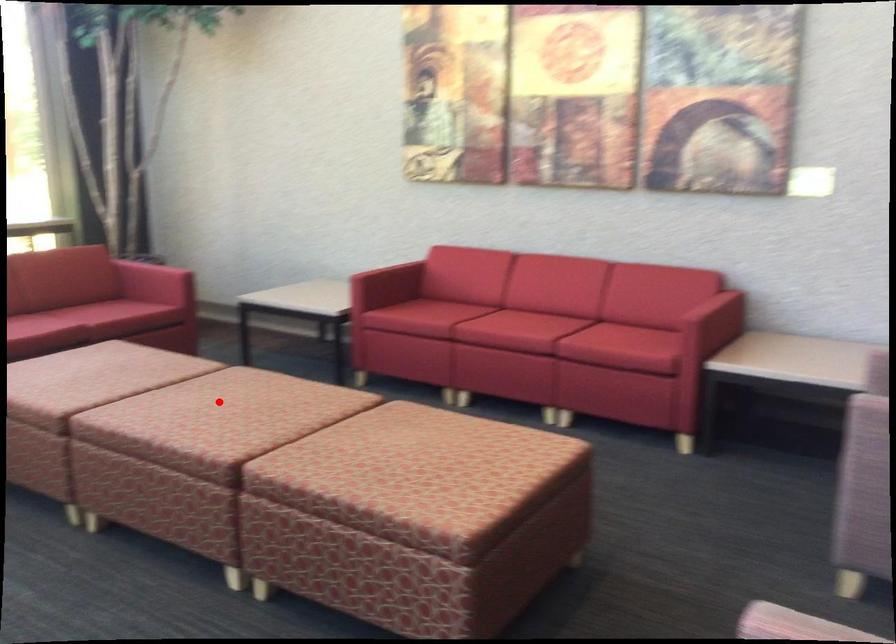
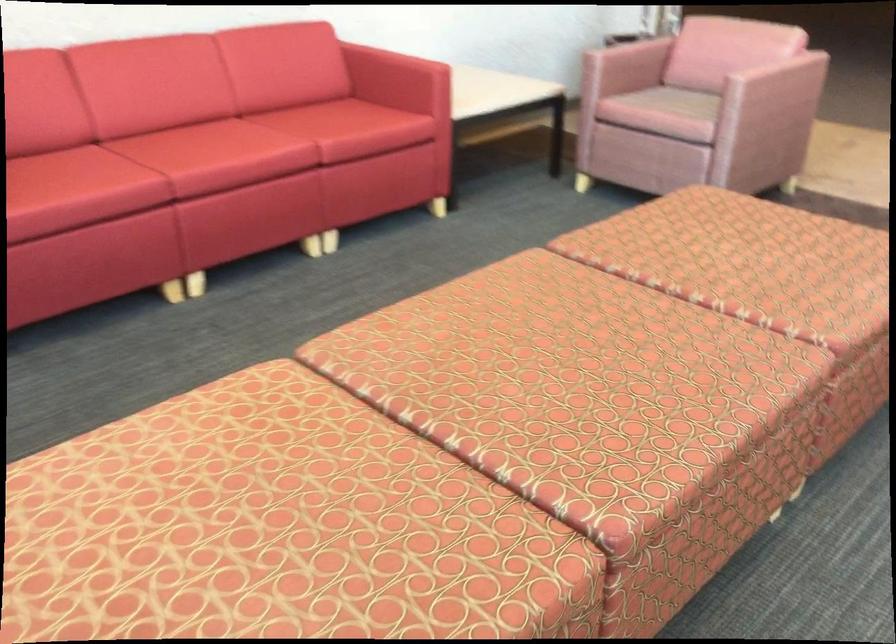
Find the pixel in the second image that matches the highlighted location in the first image.

(549, 377)